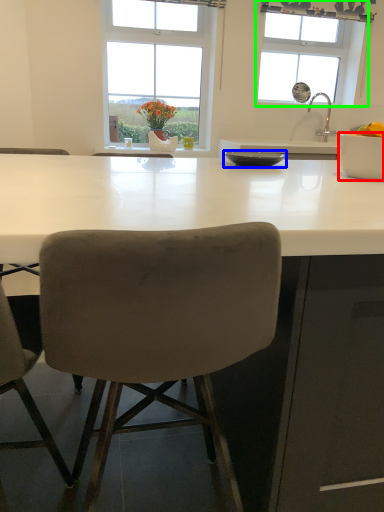
Question: Which object is the farthest from bowl (highlighted by a red box)? Choose among these: bowl (highlighted by a blue box) or window (highlighted by a green box).

Choices:
 (A) bowl
 (B) window

Answer: (B)